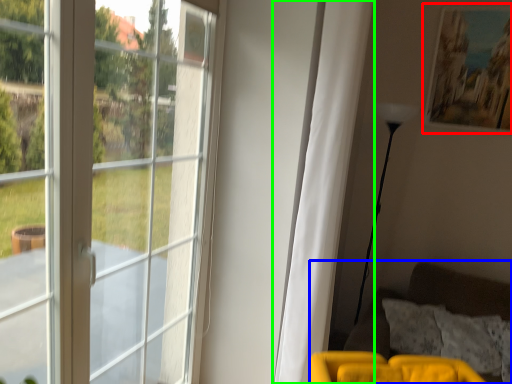
Question: Which object is positioned farthest from picture frame (highlighted by a red box)? Select from couch (highlighted by a blue box) and curtain (highlighted by a green box).

Choices:
 (A) couch
 (B) curtain

Answer: (A)